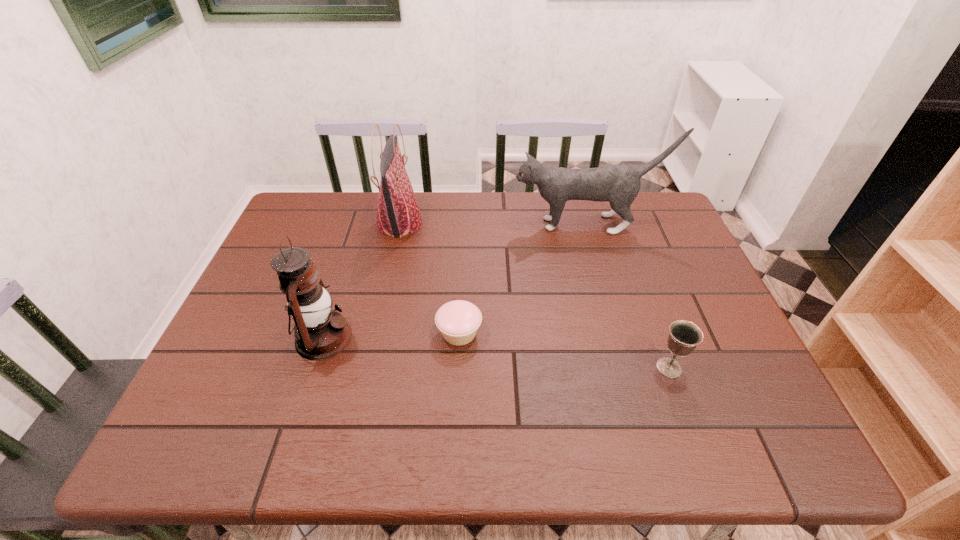
You are a GUI agent. You are given a task and a screenshot of the screen. Output one action in this format:
    pyautogui.click(x=<x>, y=<y>)
    Task: Click on the vacant position at the left edge of the desktop
    Image resolution: width=960 pixels, height=540 pixels.
    Given the screenshot: What is the action you would take?
    pyautogui.click(x=267, y=317)

At what (x,y) coordinates should I click in order to perform the action: click on free space at the right edge of the desktop. Please return your answer as a coordinate pair (x, y). The height and width of the screenshot is (540, 960). Looking at the image, I should click on (742, 387).

In the image, there is a desktop. In order to click on vacant region at the far left corner in this screenshot , I will do `click(308, 204)`.

In the image, there is a desktop. Where is `blank space at the near right corner`? This screenshot has width=960, height=540. blank space at the near right corner is located at coordinates (x=758, y=429).

Identify the location of vacant point located between the third object from left to right and the lantern. (392, 335).

Find the location of `blank region between the cat and the lantern`. blank region between the cat and the lantern is located at coordinates (455, 281).

Image resolution: width=960 pixels, height=540 pixels. Find the location of `vacant area that lies between the cat and the handbag`. vacant area that lies between the cat and the handbag is located at coordinates (493, 224).

The width and height of the screenshot is (960, 540). In order to click on vacant space that's between the shortest object and the cat in this screenshot , I will do `click(523, 278)`.

At what (x,y) coordinates should I click in order to perform the action: click on blank region between the cat and the chalice. Please return your answer as a coordinate pair (x, y). The height and width of the screenshot is (540, 960). Looking at the image, I should click on click(x=628, y=296).

Locate an element on the screen. The height and width of the screenshot is (540, 960). vacant space that's between the cupcake and the lantern is located at coordinates (392, 335).